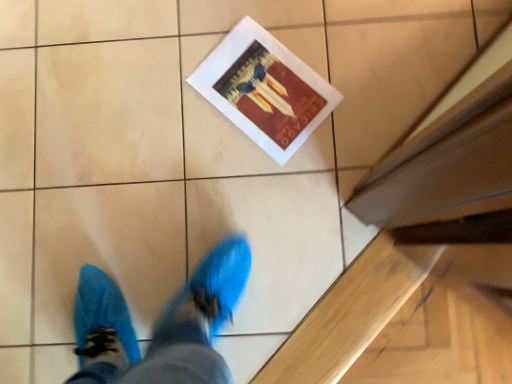
The height and width of the screenshot is (384, 512). In order to click on free space behind matte paper postcard at center in this screenshot , I will do `click(225, 20)`.